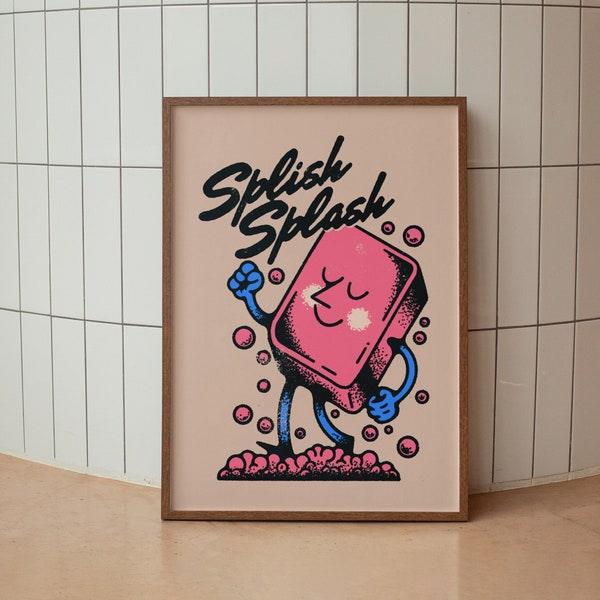
You are a GUI agent. You are given a task and a screenshot of the screen. Output one action in this format:
    pyautogui.click(x=<x>, y=<y>)
    Task: Click on the wall
    
    Given the screenshot: What is the action you would take?
    pyautogui.click(x=48, y=245), pyautogui.click(x=557, y=240)